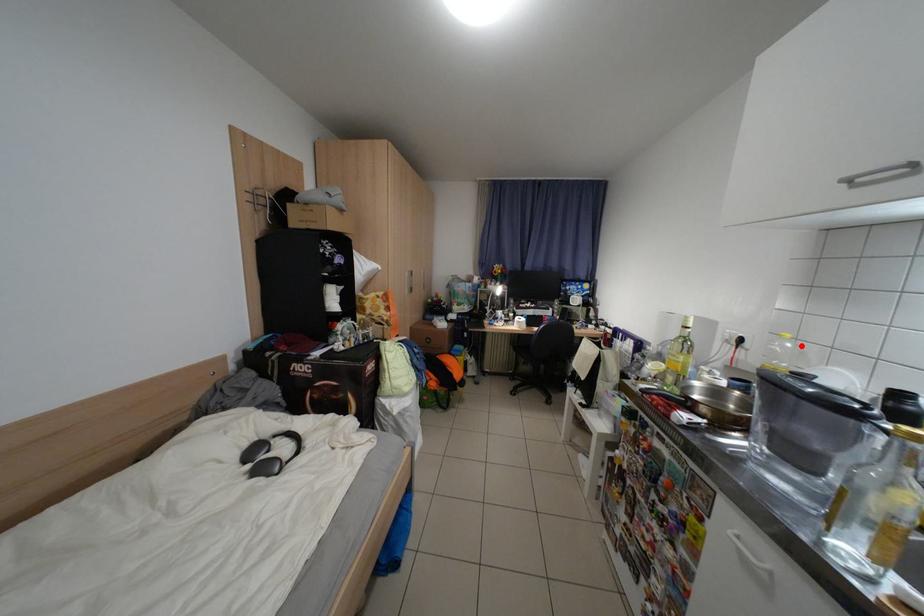
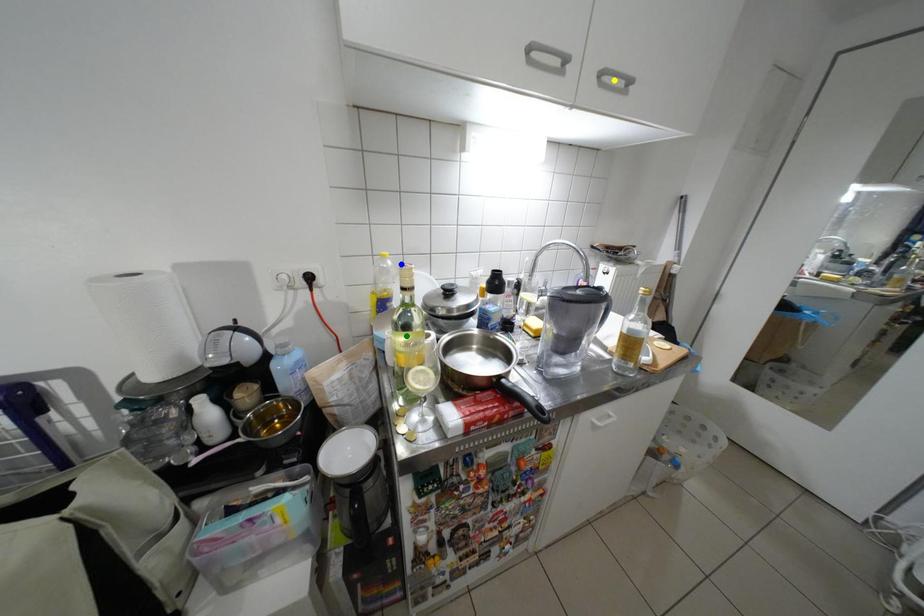
Question: I am providing you with two images of the same scene from different viewpoints. A red point is marked on the first image. You are given multiple points on the second image. Can you choose the point in image 2 that corresponds to the point in image 1?

Choices:
 (A) blue point
 (B) green point
 (C) yellow point

Answer: (A)